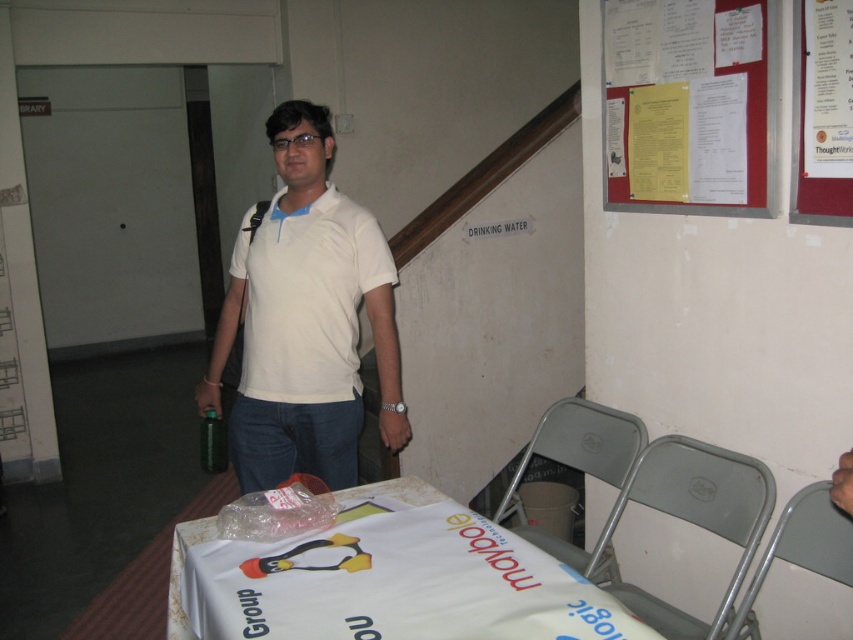
You are organizing a small event and need to place a decorative centerpiece on the white paper table at lower center. Considering the size of the green matte bottle at center, will the table have enough space to accommodate both the bottle and the centerpiece?

The white paper table at lower center has a larger size compared to the green matte bottle at center, so there should be sufficient space to place both the bottle and the centerpiece on the table.

You are a fashion designer observing the scene. You need to decide which item has a greater width for a size comparison project. Which object is wider between the white matte polo shirt at center and the red paperboard at upper right?

The white matte polo shirt at center has a greater width compared to the red paperboard at upper right, as stated in the description that the white matte polo shirt at center is wider than the red paperboard at upper right.

You are an observer in the scene. You notice the white matte shirt at center and the yellow paper at upper right. Which object is wider?

The white matte shirt at center is wider than the yellow paper at upper right.